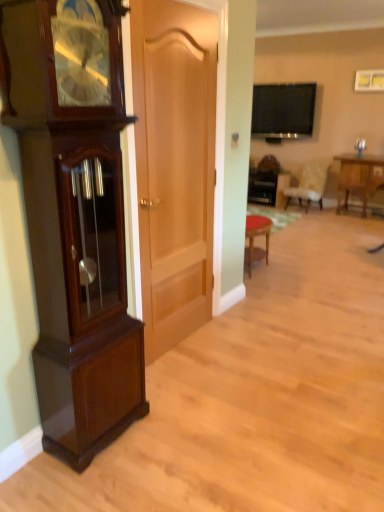
Where is `vacant area that lies in front of light brown wood door at center`? The height and width of the screenshot is (512, 384). vacant area that lies in front of light brown wood door at center is located at coordinates (193, 378).